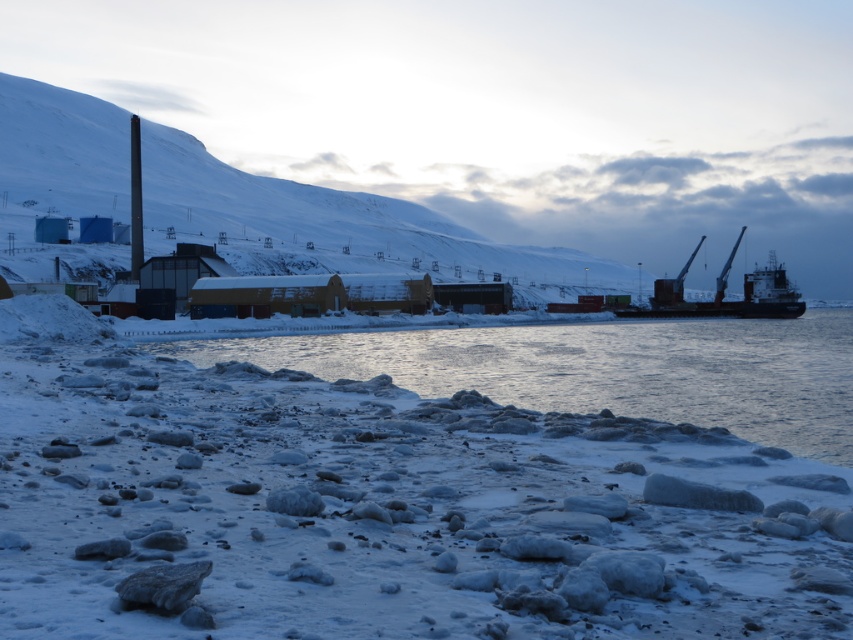
Question: Which object is farther from the camera taking this photo?

Choices:
 (A) white frosty snow at lower left
 (B) clear ice water at lower center

Answer: (B)

Question: Does white frosty snow at lower left appear under dark gray metallic ship at right?

Choices:
 (A) yes
 (B) no

Answer: (A)

Question: Among these points, which one is nearest to the camera?

Choices:
 (A) (759, 300)
 (B) (241, 490)
 (C) (838, 312)

Answer: (B)

Question: Which point is farther to the camera?

Choices:
 (A) (577, 394)
 (B) (730, 252)

Answer: (B)

Question: Observing the image, what is the correct spatial positioning of clear ice water at lower center in reference to dark gray metallic ship at right?

Choices:
 (A) right
 (B) left

Answer: (B)

Question: Is clear ice water at lower center further to camera compared to dark gray metallic ship at right?

Choices:
 (A) yes
 (B) no

Answer: (B)